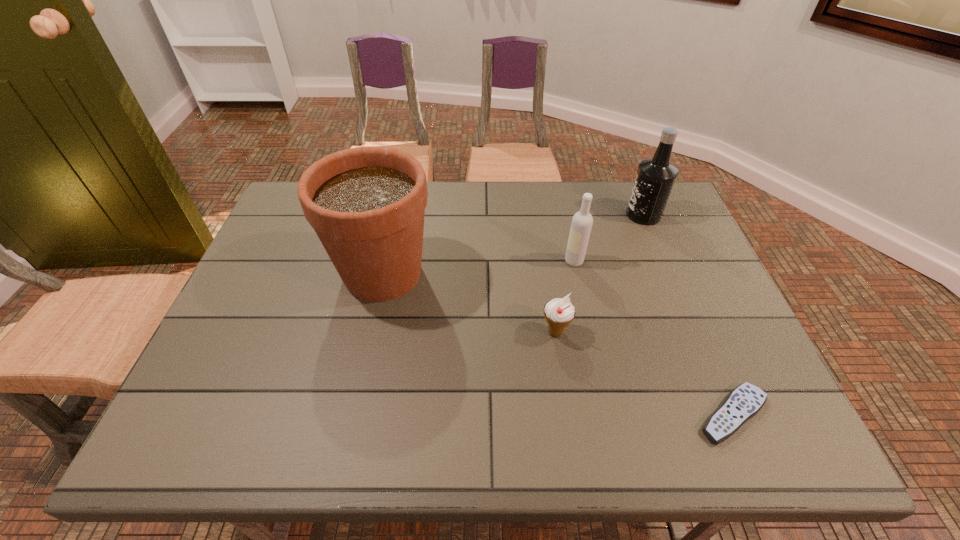
Find the location of a particular element. This screenshot has width=960, height=540. flowerpot is located at coordinates (367, 204).

This screenshot has height=540, width=960. Find the location of `liquor`. liquor is located at coordinates (655, 177).

Image resolution: width=960 pixels, height=540 pixels. Identify the location of the third object from left to right. (582, 221).

I want to click on the third tallest object, so click(x=582, y=221).

At what (x,y) coordinates should I click in order to perform the action: click on the fourth tallest object. Please return your answer as a coordinate pair (x, y). This screenshot has width=960, height=540. Looking at the image, I should click on (559, 312).

At what (x,y) coordinates should I click in order to perform the action: click on the second object from left to right. Please return your answer as a coordinate pair (x, y). Looking at the image, I should click on (559, 312).

Locate an element on the screen. The width and height of the screenshot is (960, 540). remote control is located at coordinates (745, 401).

Where is `the nearest object`? The height and width of the screenshot is (540, 960). the nearest object is located at coordinates (745, 401).

Locate an element on the screen. vacant space located 0.090m on the back of the leftmost object is located at coordinates (395, 220).

I want to click on free region located on the front label of the farthest object, so click(x=522, y=215).